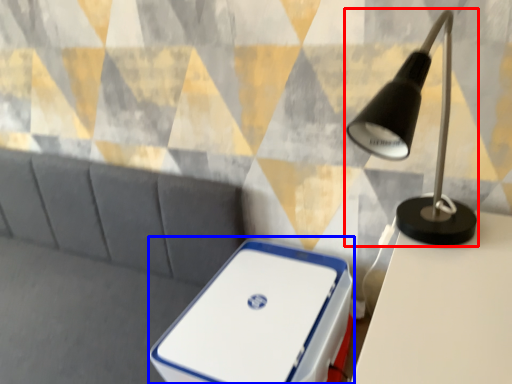
Question: Which of the following is the closest to the observer, lamp (highlighted by a red box) or storage box (highlighted by a blue box)?

Choices:
 (A) lamp
 (B) storage box

Answer: (A)